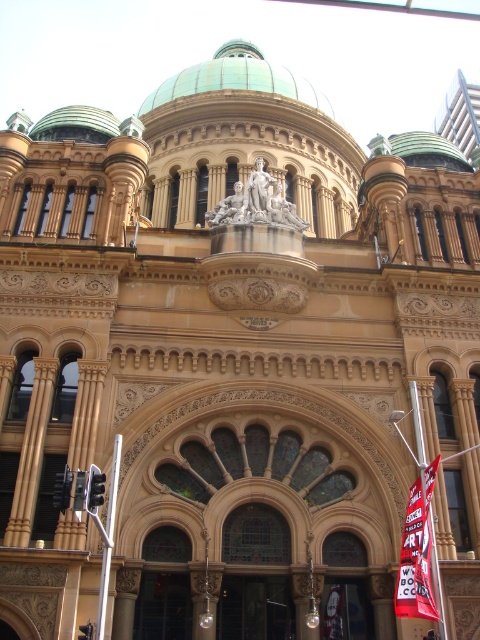
Question: Which point is closer to the camera?

Choices:
 (A) (106, 124)
 (B) (425, 609)

Answer: (B)

Question: Does red fabric banner at lower right appear on the right side of green copper dome at upper center?

Choices:
 (A) yes
 (B) no

Answer: (A)

Question: Is the position of red fabric banner at lower right less distant than that of green copper dome at upper center?

Choices:
 (A) no
 (B) yes

Answer: (B)

Question: Observing the image, what is the correct spatial positioning of red fabric banner at lower right in reference to green copper dome at upper center?

Choices:
 (A) below
 (B) above

Answer: (A)